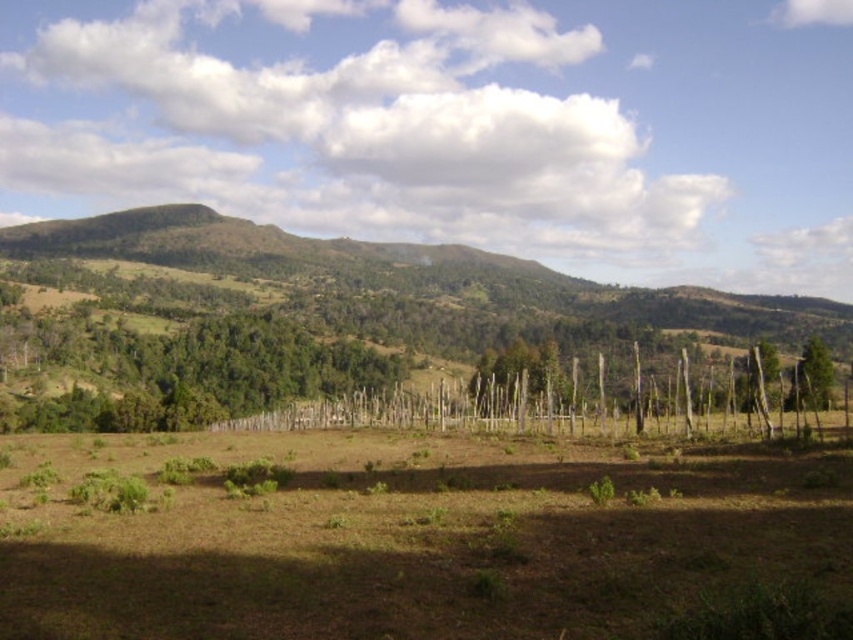
Looking at this image, is brown grassy field at center wider than green rough bark tree at right?

No, brown grassy field at center is not wider than green rough bark tree at right.

Is brown grassy field at center positioned before green rough bark tree at right?

Yes, it is in front of green rough bark tree at right.

This screenshot has height=640, width=853. Find the location of `brown grassy field at center`. brown grassy field at center is located at coordinates (418, 538).